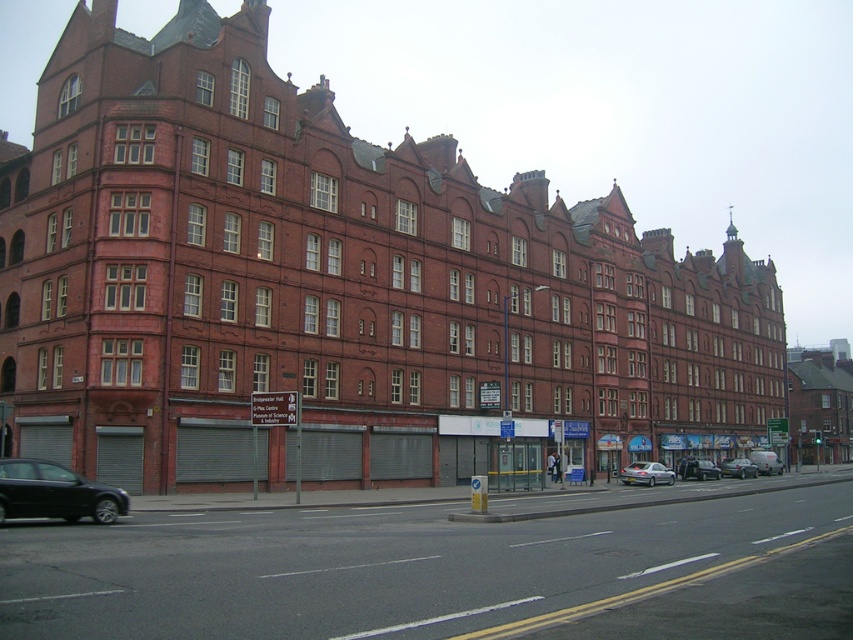
Which is above, silver metallic car at center or white matte van at center-right?

silver metallic car at center is higher up.

Describe the element at coordinates (697, 468) in the screenshot. I see `silver metallic car at center` at that location.

Is point (706, 468) closer to viewer compared to point (766, 464)?

That is True.

Find the location of a particular element. silver metallic car at center is located at coordinates pyautogui.click(x=697, y=468).

Is point (773, 458) positioned behind point (730, 465)?

That is True.

Between white matte van at center-right and silver metallic van at center, which one has more height?

silver metallic van at center is taller.

The width and height of the screenshot is (853, 640). What do you see at coordinates (766, 461) in the screenshot?
I see `white matte van at center-right` at bounding box center [766, 461].

Locate an element on the screen. The height and width of the screenshot is (640, 853). white matte van at center-right is located at coordinates (766, 461).

Consider the image. Between silver metallic sedan at center and silver metallic van at center, which one appears on the left side from the viewer's perspective?

Positioned to the left is silver metallic sedan at center.

Does silver metallic sedan at center come behind silver metallic van at center?

No, silver metallic sedan at center is closer to the viewer.

Is point (628, 481) farther from camera compared to point (740, 460)?

That is False.

I want to click on silver metallic sedan at center, so click(x=646, y=474).